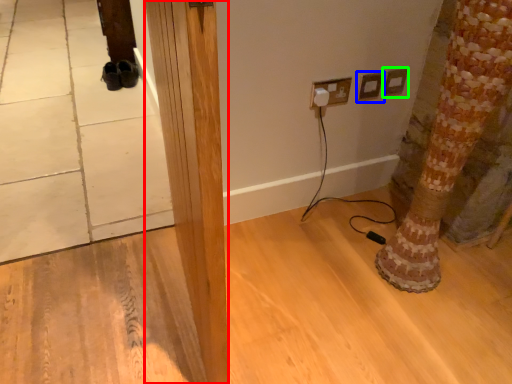
Question: Estimate the real-world distances between objects in this image. Which object is farther from pillar (highlighted by a red box), electric outlet (highlighted by a blue box) or electric outlet (highlighted by a green box)?

Choices:
 (A) electric outlet
 (B) electric outlet

Answer: (B)